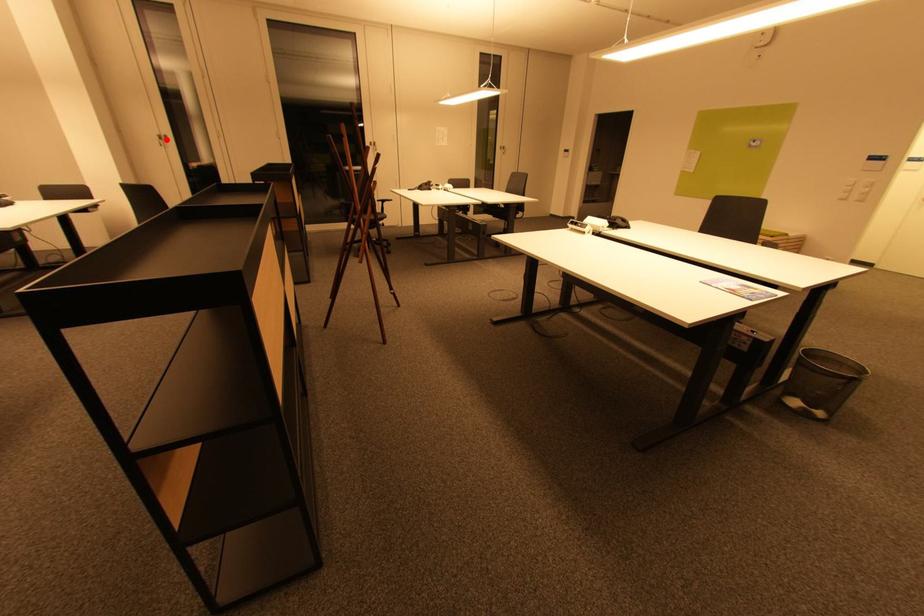
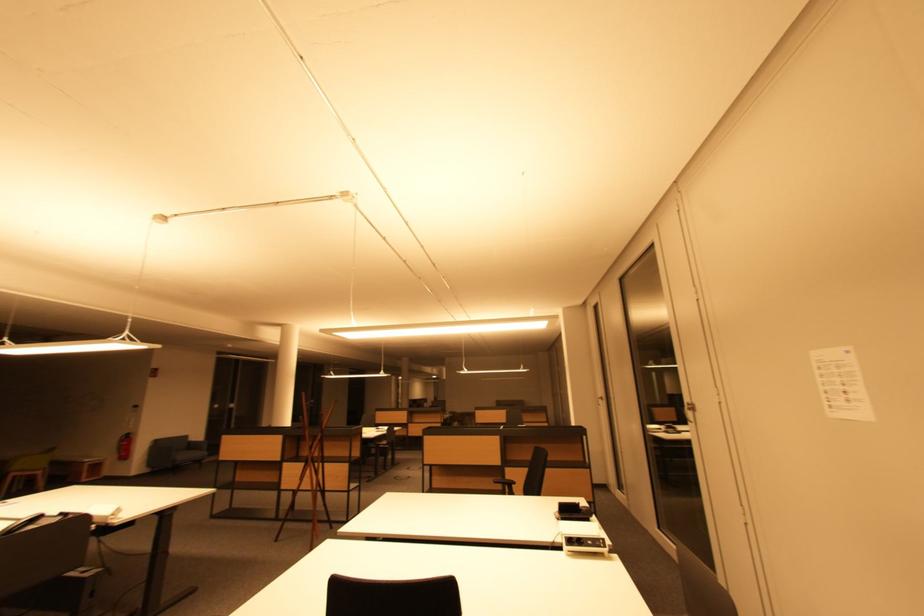
In the second image, find the point that corresponds to the highlighted location in the first image.

(605, 400)